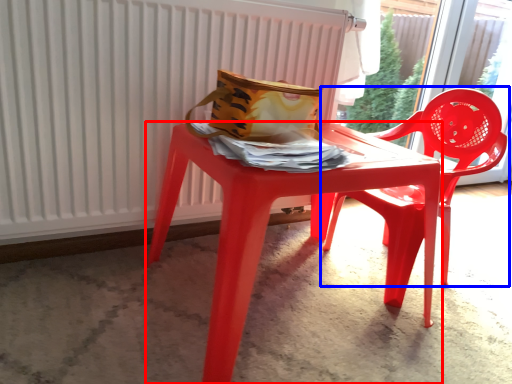
Question: Which object appears farthest to the camera in this image, table (highlighted by a red box) or chair (highlighted by a blue box)?

Choices:
 (A) table
 (B) chair

Answer: (B)